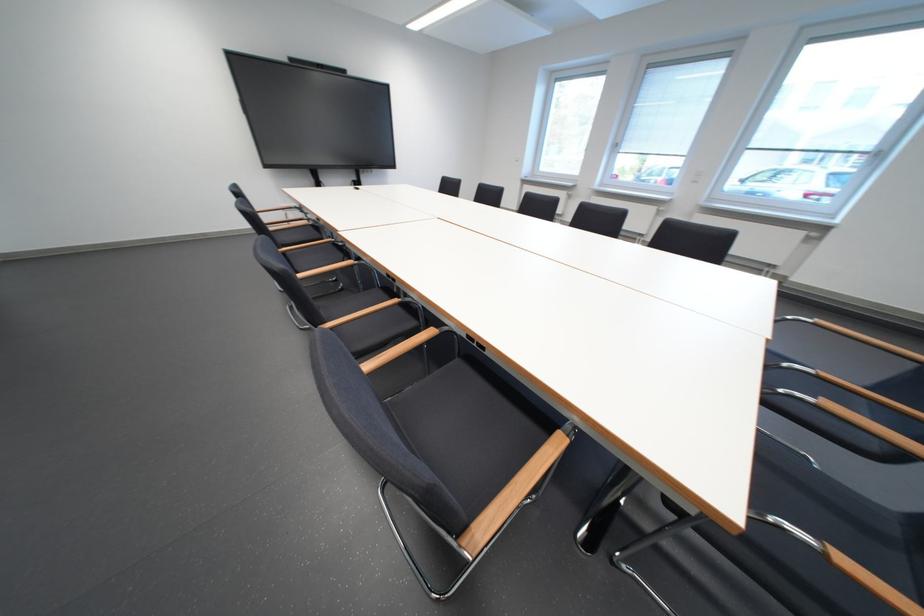
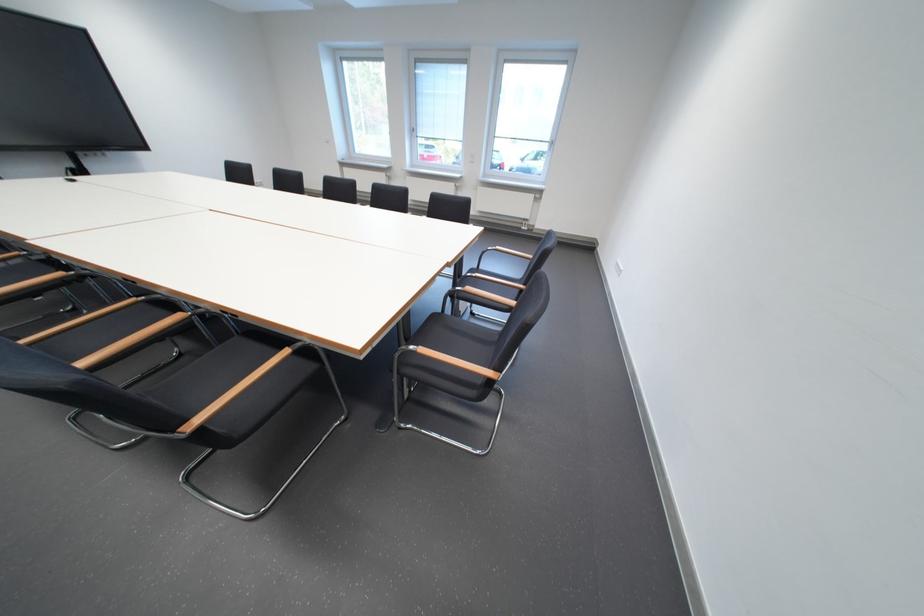
Question: The first image is from the beginning of the video and the second image is from the end. How did the camera likely rotate when shooting the video?

Choices:
 (A) Left
 (B) Right
 (C) Up
 (D) Down

Answer: (B)